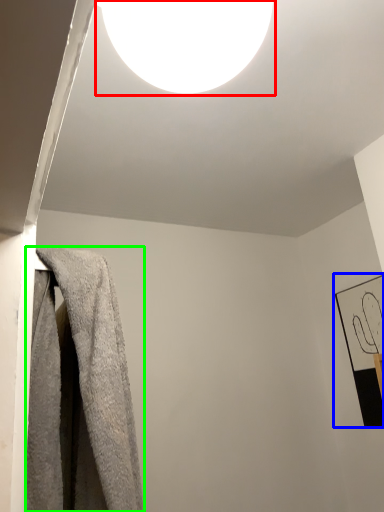
Question: Which object is the closest to the lamp (highlighted by a red box)? Choose among these: picture frame (highlighted by a blue box) or towel (highlighted by a green box).

Choices:
 (A) picture frame
 (B) towel

Answer: (B)